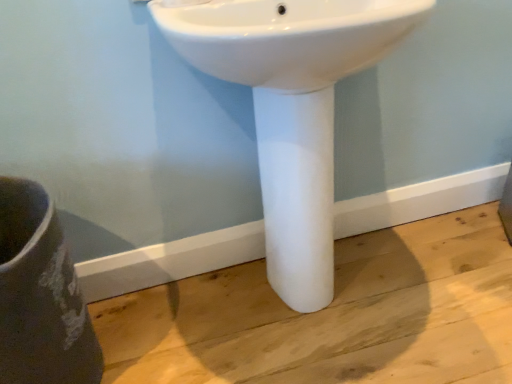
You are a GUI agent. You are given a task and a screenshot of the screen. Output one action in this format:
    pyautogui.click(x=<x>, y=<y>)
    Task: Click on the white glossy sink at center
    The image size is (512, 384).
    Given the screenshot: What is the action you would take?
    pyautogui.click(x=291, y=107)

Describe the element at coordinates (291, 107) in the screenshot. I see `white glossy sink at center` at that location.

Find the location of `matte gray vase at lower left`. matte gray vase at lower left is located at coordinates (40, 296).

Image resolution: width=512 pixels, height=384 pixels. Describe the element at coordinates (40, 296) in the screenshot. I see `matte gray vase at lower left` at that location.

Locate an element on the screen. The width and height of the screenshot is (512, 384). white glossy sink at center is located at coordinates (291, 107).

Between white glossy sink at center and matte gray vase at lower left, which one appears on the left side from the viewer's perspective?

Positioned to the left is matte gray vase at lower left.

Which object is further away from the camera taking this photo, white glossy sink at center or matte gray vase at lower left?

Positioned behind is matte gray vase at lower left.

Is point (221, 60) closer to camera compared to point (9, 320)?

Yes.

From the image's perspective, between white glossy sink at center and matte gray vase at lower left, who is located below?

From the image's view, matte gray vase at lower left is below.

From a real-world perspective, is white glossy sink at center physically below matte gray vase at lower left?

No.

Does white glossy sink at center have a greater width compared to matte gray vase at lower left?

In fact, white glossy sink at center might be narrower than matte gray vase at lower left.

Considering the relative sizes of white glossy sink at center and matte gray vase at lower left in the image provided, is white glossy sink at center taller than matte gray vase at lower left?

Yes, white glossy sink at center is taller than matte gray vase at lower left.

Based on their sizes in the image, would you say white glossy sink at center is bigger or smaller than matte gray vase at lower left?

Clearly, white glossy sink at center is larger in size than matte gray vase at lower left.

Is white glossy sink at center not inside matte gray vase at lower left?

white glossy sink at center is positioned outside matte gray vase at lower left.

Is white glossy sink at center directly adjacent to matte gray vase at lower left?

No, white glossy sink at center is not touching matte gray vase at lower left.

Is white glossy sink at center aimed at matte gray vase at lower left?

No, white glossy sink at center is not turned towards matte gray vase at lower left.

Can you tell me how much white glossy sink at center and matte gray vase at lower left differ in facing direction?

There is a 4.24-degree angle between the facing directions of white glossy sink at center and matte gray vase at lower left.

Measure the distance from white glossy sink at center to matte gray vase at lower left.

A distance of 21.44 inches exists between white glossy sink at center and matte gray vase at lower left.

At what (x,y) coordinates should I click in order to perform the action: click on porcelain behind the white glossy sink at center. Please return your answer as a coordinate pair (x, y). The height and width of the screenshot is (384, 512). Looking at the image, I should click on (40, 296).

Can you confirm if matte gray vase at lower left is positioned to the right of white glossy sink at center?

Incorrect, matte gray vase at lower left is not on the right side of white glossy sink at center.

Is matte gray vase at lower left closer to the viewer compared to white glossy sink at center?

No, it is behind white glossy sink at center.

Between point (60, 311) and point (348, 26), which one is positioned behind?

The point (60, 311) is farther from the camera.

From the image's perspective, is matte gray vase at lower left located above or below white glossy sink at center?

From the image's perspective, matte gray vase at lower left appears below white glossy sink at center.

From a real-world perspective, is matte gray vase at lower left above or below white glossy sink at center?

matte gray vase at lower left is situated lower than white glossy sink at center in the real world.

Which of these two, matte gray vase at lower left or white glossy sink at center, is thinner?

Thinner between the two is white glossy sink at center.

Can you confirm if matte gray vase at lower left is shorter than white glossy sink at center?

Yes, matte gray vase at lower left is shorter than white glossy sink at center.

Which of these two, matte gray vase at lower left or white glossy sink at center, is bigger?

white glossy sink at center is bigger.

Is matte gray vase at lower left positioned beyond the bounds of white glossy sink at center?

Indeed, matte gray vase at lower left is completely outside white glossy sink at center.

Is matte gray vase at lower left with white glossy sink at center?

No, matte gray vase at lower left is not in contact with white glossy sink at center.

Is matte gray vase at lower left positioned with its back to white glossy sink at center?

No.

You are a GUI agent. You are given a task and a screenshot of the screen. Output one action in this format:
    pyautogui.click(x=<x>, y=<y>)
    Task: Click on the sink above the matte gray vase at lower left (from the image's perspective)
    
    Given the screenshot: What is the action you would take?
    pyautogui.click(x=291, y=107)

The width and height of the screenshot is (512, 384). Identify the location of sink located above the matte gray vase at lower left (from a real-world perspective). (291, 107).

Image resolution: width=512 pixels, height=384 pixels. What are the coordinates of `porcelain located on the left of white glossy sink at center` in the screenshot? It's located at (40, 296).